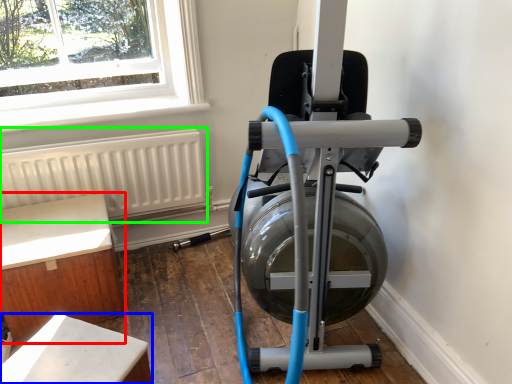
Question: Considering the real-world distances, which object is farthest from furniture (highlighted by a red box)? furniture (highlighted by a blue box) or radiator (highlighted by a green box)?

Choices:
 (A) furniture
 (B) radiator

Answer: (A)